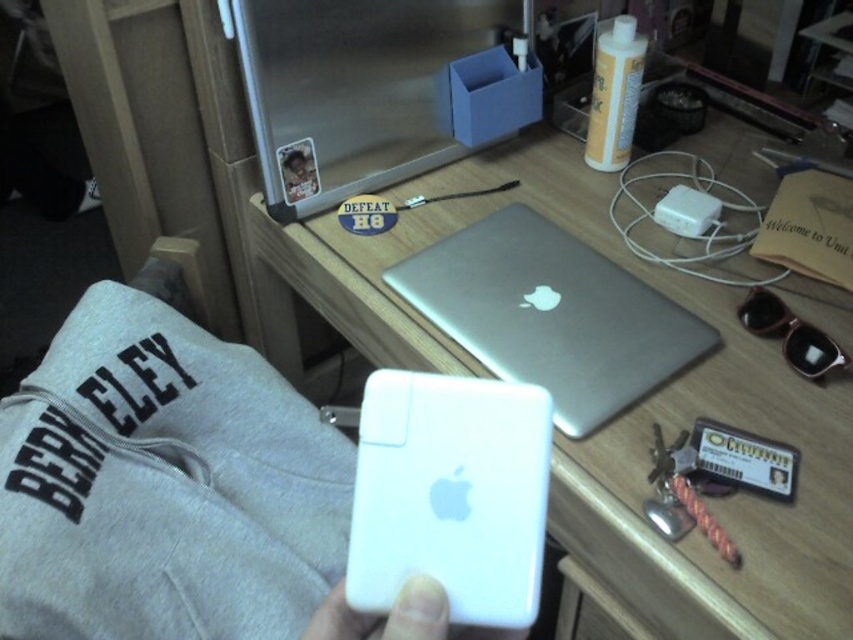
You are organizing your desk and want to move the silver metallic laptop at center closer to the wall. Which direction should you move it relative to the wooden desk at center?

The wooden desk at center is positioned on the right side of the silver metallic laptop at center. To move the silver metallic laptop at center closer to the wall, you should move it to the left away from the wooden desk at center.

What object is located at the coordinates point [165,486] on the desk?

The white plastic power bank at center is located at the coordinates point [165,486].

You are a person who wants to reach the white plastic power bank at center on the desk without moving any other items. Can you do it?

The white plastic power bank at center is 19.24 inches from viewer, so yes, you can reach it without moving other items as it is within arm reach.